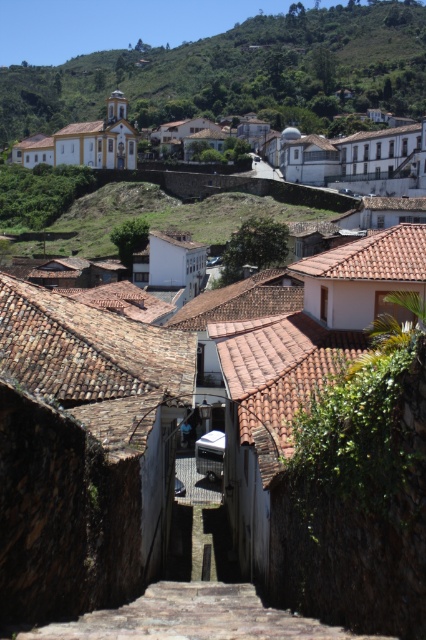
Does brown stone stairs at center have a greater height compared to yellow painted church at upper left?

No.

Does brown stone stairs at center appear over yellow painted church at upper left?

Actually, brown stone stairs at center is below yellow painted church at upper left.

The width and height of the screenshot is (426, 640). Identify the location of brown stone stairs at center. (192, 618).

Does green grassy hillside at upper center have a lesser height compared to brown stone stairs at center?

No, green grassy hillside at upper center is not shorter than brown stone stairs at center.

Does green grassy hillside at upper center lie behind brown stone stairs at center?

Yes, it is.

Where is `green grassy hillside at upper center`? The image size is (426, 640). green grassy hillside at upper center is located at coordinates (152, 202).

Which is in front, point (227, 72) or point (121, 616)?

Positioned in front is point (121, 616).

Is point (374, 10) closer to camera compared to point (247, 627)?

No, it is behind (247, 627).

Locate an element on the screen. The height and width of the screenshot is (640, 426). green leafy hillside at upper center is located at coordinates (238, 72).

Locate an element on the screen. Image resolution: width=426 pixels, height=640 pixels. green leafy hillside at upper center is located at coordinates (238, 72).